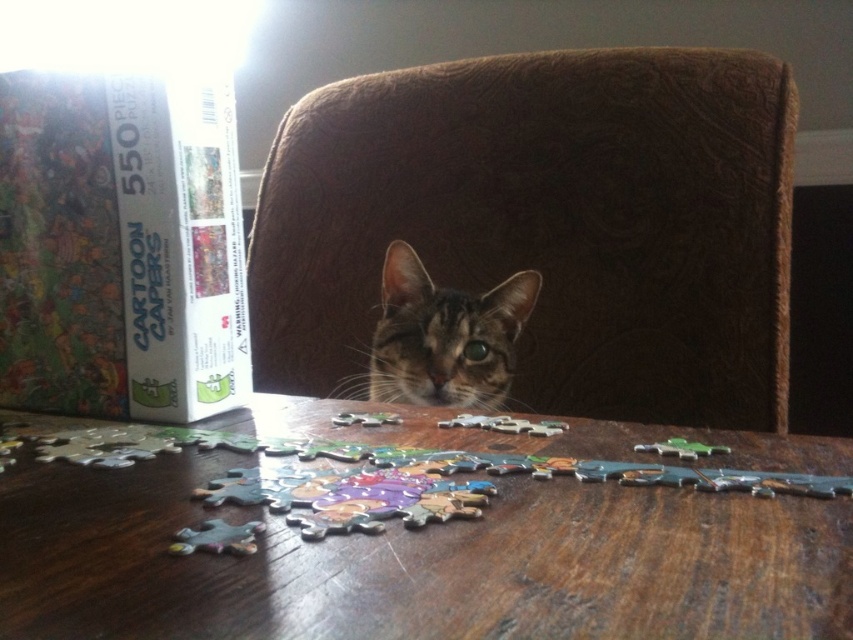
You are trying to reach the matte cardboard box at left to retrieve the puzzle instructions. The tabby fur cat at center is blocking your path. Can you safely step over the cat without disturbing it?

The matte cardboard box at left is above the tabby fur cat at center, so stepping over the cat would allow you to reach the box without disturbing it.

You are trying to place a new puzzle piece on the wooden table at center. The coordinates of the table are given as point [421,564]. Can you confirm if this point is the center of the table?

The wooden table at center is located at point [421,564], so yes, this point is indeed the center of the table.

In the scene shown: You are organizing a puzzle party and need to place the matte cardboard box at left and the tabby fur cat at center on a shelf. The shelf can only hold items where the smaller one is placed in front to avoid blocking the view. According to the scene description, which object should be placed in front?

The matte cardboard box at left has a smaller size compared to the tabby fur cat at center, so the matte cardboard box at left should be placed in front to ensure it doesn not block the view of the larger item.